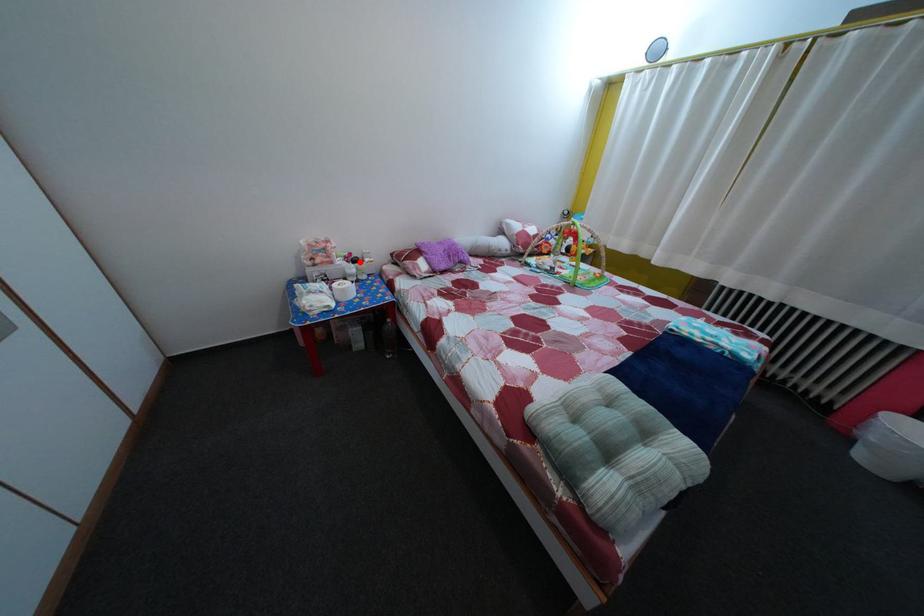
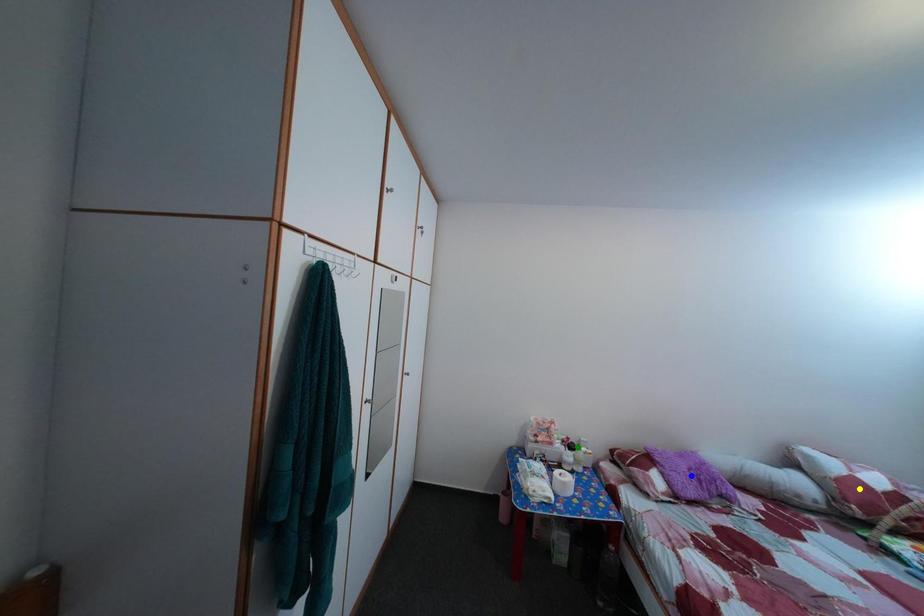
Question: I am providing you with two images of the same scene from different viewpoints. A red point is marked on the first image. You are given multiple points on the second image. In image 2, which mark is for the same physical point as the one in image 1?

Choices:
 (A) yellow point
 (B) green point
 (C) blue point

Answer: (B)